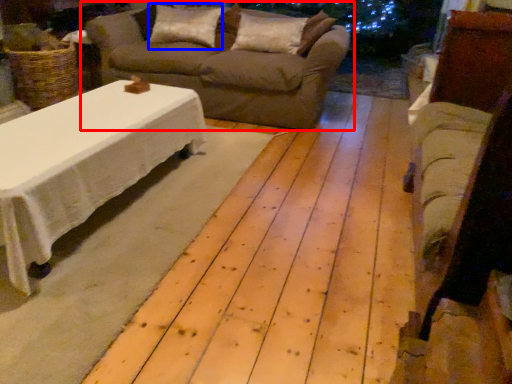
Question: Among these objects, which one is nearest to the camera, studio couch (highlighted by a red box) or pillow (highlighted by a blue box)?

Choices:
 (A) studio couch
 (B) pillow

Answer: (A)